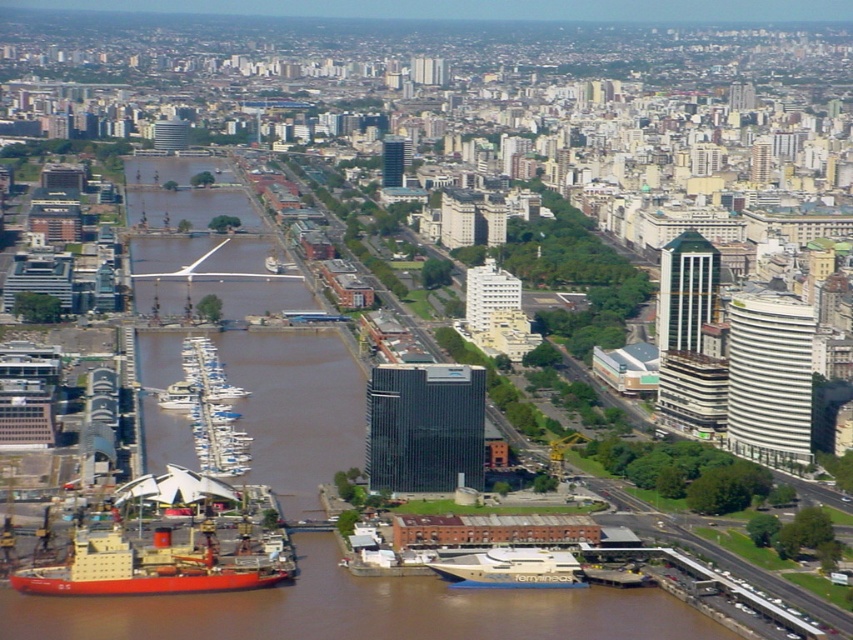
Question: Does red matte ship at lower left appear on the right side of white glossy boats at center-left?

Choices:
 (A) no
 (B) yes

Answer: (A)

Question: Is red matte ship at lower left smaller than gold polished yacht at lower center?

Choices:
 (A) yes
 (B) no

Answer: (B)

Question: Which of the following is the closest to the observer?

Choices:
 (A) (256, 556)
 (B) (509, 570)

Answer: (B)

Question: From the image, what is the correct spatial relationship of red matte ship at lower left in relation to gold polished yacht at lower center?

Choices:
 (A) right
 (B) left

Answer: (B)

Question: Which point is farther to the camera?

Choices:
 (A) red matte ship at lower left
 (B) white glossy boats at center-left
 (C) gold polished yacht at lower center

Answer: (A)

Question: Among these points, which one is farthest from the camera?

Choices:
 (A) (564, 561)
 (B) (202, 532)

Answer: (B)